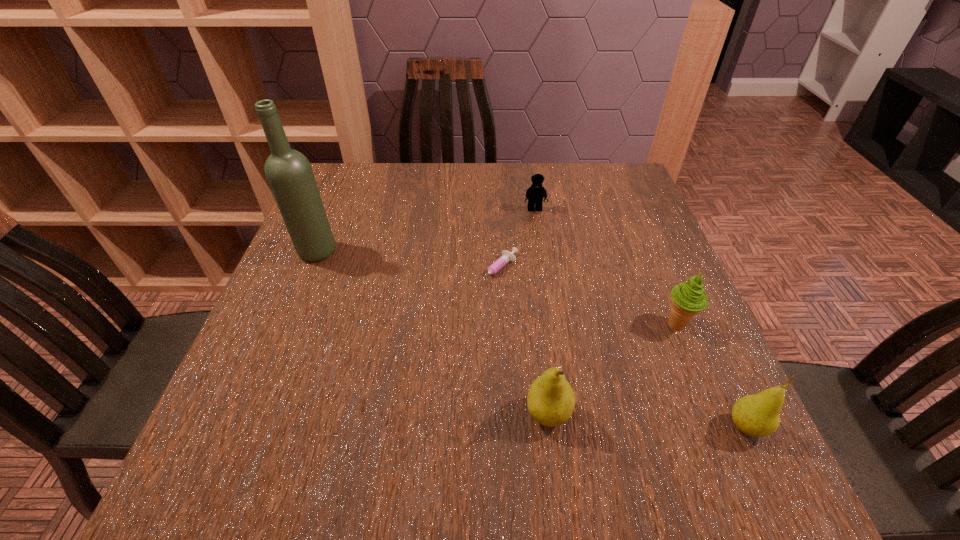
Identify the location of the left pear. This screenshot has height=540, width=960. (551, 401).

Find the location of a particular element. This screenshot has width=960, height=540. the shorter pear is located at coordinates (757, 415).

This screenshot has width=960, height=540. I want to click on the farthest object, so click(535, 193).

Locate an element on the screen. The image size is (960, 540). the fifth tallest object is located at coordinates (535, 193).

At what (x,y) coordinates should I click in order to perform the action: click on wine bottle. Please return your answer as a coordinate pair (x, y). This screenshot has width=960, height=540. Looking at the image, I should click on (289, 173).

At what (x,y) coordinates should I click in order to perform the action: click on the tallest object. Please return your answer as a coordinate pair (x, y). Image resolution: width=960 pixels, height=540 pixels. Looking at the image, I should click on (289, 173).

At what (x,y) coordinates should I click in order to perform the action: click on icecream. Please return your answer as a coordinate pair (x, y). Looking at the image, I should click on (688, 298).

This screenshot has width=960, height=540. I want to click on the shortest object, so click(x=507, y=256).

The image size is (960, 540). Find the location of `free spot located 0.240m on the left of the taller pear`. free spot located 0.240m on the left of the taller pear is located at coordinates (384, 414).

You are a GUI agent. You are given a task and a screenshot of the screen. Output one action in this format:
    pyautogui.click(x=<x>, y=<y>)
    Task: Click on the vacant space located on the back of the right pear
    
    Given the screenshot: What is the action you would take?
    pyautogui.click(x=676, y=276)